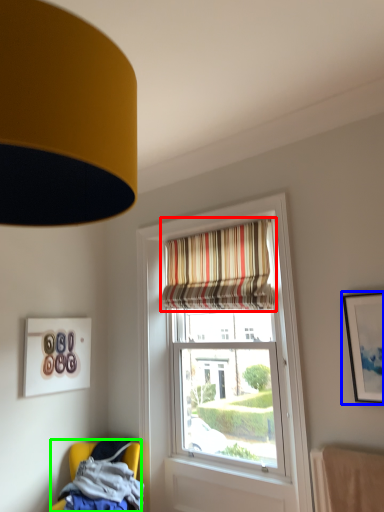
Question: Which object is the closest to the curtain (highlighted by a red box)? Choose among these: picture frame (highlighted by a blue box) or chair (highlighted by a green box).

Choices:
 (A) picture frame
 (B) chair

Answer: (A)